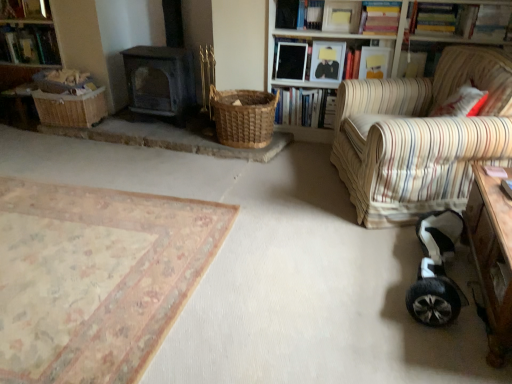
Question: Can you confirm if wooden bookshelf at upper right is smaller than woven brown basket at center, the 2th basket positioned from the left?

Choices:
 (A) yes
 (B) no

Answer: (B)

Question: Is wooden bookshelf at upper right at the right side of woven brown basket at center, placed as the first basket when sorted from right to left?

Choices:
 (A) yes
 (B) no

Answer: (A)

Question: Is wooden bookshelf at upper right to the left of woven brown basket at center, placed as the first basket when sorted from right to left, from the viewer's perspective?

Choices:
 (A) yes
 (B) no

Answer: (B)

Question: Is wooden bookshelf at upper right far away from woven brown basket at center, placed as the first basket when sorted from right to left?

Choices:
 (A) no
 (B) yes

Answer: (A)

Question: Does wooden bookshelf at upper right lie in front of woven brown basket at center, placed as the first basket when sorted from right to left?

Choices:
 (A) no
 (B) yes

Answer: (B)

Question: From the image's perspective, is hardcover book at upper right, marked as the 4th book in a right-to-left arrangement, located above or below black glossy book at upper center, the eighth book in the right-to-left sequence?

Choices:
 (A) above
 (B) below

Answer: (B)

Question: Considering the positions of hardcover book at upper right, marked as the 4th book in a right-to-left arrangement, and black glossy book at upper center, which is the third book from left to right, in the image, is hardcover book at upper right, marked as the 4th book in a right-to-left arrangement, wider or thinner than black glossy book at upper center, which is the third book from left to right,?

Choices:
 (A) wide
 (B) thin

Answer: (A)

Question: Considering the positions of point (358, 51) and point (288, 76), is point (358, 51) closer or farther from the camera than point (288, 76)?

Choices:
 (A) closer
 (B) farther

Answer: (A)

Question: From a real-world perspective, is hardcover book at upper right, marked as the 4th book in a right-to-left arrangement, positioned above or below black glossy book at upper center, which is the third book from left to right?

Choices:
 (A) above
 (B) below

Answer: (A)

Question: Is hardcover books at upper center, the 4th book positioned from the left, spatially inside wooden frame at upper center, arranged as the 6th book when viewed from the left, or outside of it?

Choices:
 (A) inside
 (B) outside

Answer: (B)

Question: Relative to wooden frame at upper center, arranged as the 6th book when viewed from the left, is hardcover books at upper center, acting as the seventh book starting from the right, in front or behind?

Choices:
 (A) front
 (B) behind

Answer: (B)

Question: From a real-world perspective, is hardcover books at upper center, acting as the seventh book starting from the right, physically located above or below wooden frame at upper center, placed as the 5th book when sorted from right to left?

Choices:
 (A) above
 (B) below

Answer: (B)

Question: Considering the positions of hardcover books at upper center, acting as the seventh book starting from the right, and wooden frame at upper center, arranged as the 6th book when viewed from the left, in the image, is hardcover books at upper center, acting as the seventh book starting from the right, taller or shorter than wooden frame at upper center, arranged as the 6th book when viewed from the left,?

Choices:
 (A) tall
 (B) short

Answer: (A)

Question: From the image's perspective, is white paper book at upper center, positioned as the 9th book in left-to-right order, positioned above or below beige floral rug at lower left?

Choices:
 (A) below
 (B) above

Answer: (B)

Question: Is white paper book at upper center, positioned as the 9th book in left-to-right order, taller or shorter than beige floral rug at lower left?

Choices:
 (A) tall
 (B) short

Answer: (A)